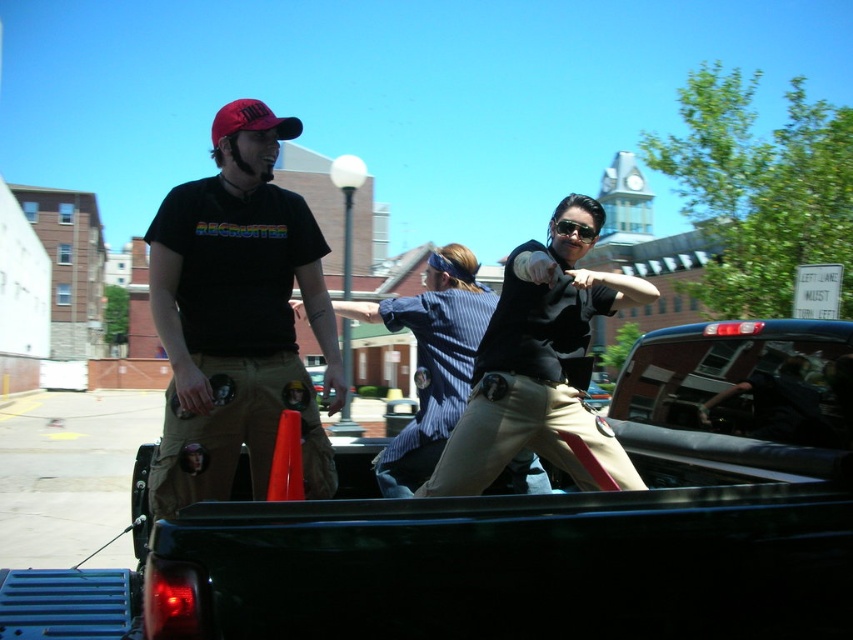
Question: Is matte black t-shirt at left smaller than khaki pants at center?

Choices:
 (A) no
 (B) yes

Answer: (A)

Question: Is matte black t-shirt at left bigger than khaki pants at center?

Choices:
 (A) no
 (B) yes

Answer: (B)

Question: Which of the following is the farthest from the observer?

Choices:
 (A) (456, 461)
 (B) (213, 316)

Answer: (B)

Question: Which of the following is the closest to the observer?

Choices:
 (A) (276, 419)
 (B) (519, 330)

Answer: (A)

Question: Can you confirm if matte black t-shirt at left is bigger than khaki pants at center?

Choices:
 (A) yes
 (B) no

Answer: (A)